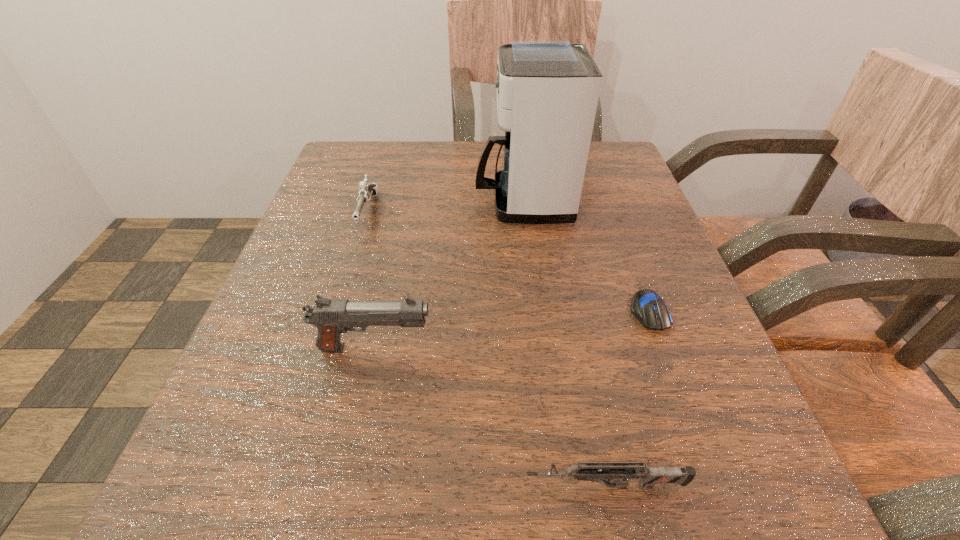
The image size is (960, 540). I want to click on object that is at the near edge, so click(590, 471).

This screenshot has width=960, height=540. I want to click on coffee maker situated at the right edge, so click(547, 90).

You are a GUI agent. You are given a task and a screenshot of the screen. Output one action in this format:
    pyautogui.click(x=<x>, y=<y>)
    Task: Click on the gun that is positioned at the right edge
    
    Given the screenshot: What is the action you would take?
    pyautogui.click(x=590, y=471)

Locate an element on the screen. computer mouse at the right edge is located at coordinates (647, 306).

Image resolution: width=960 pixels, height=540 pixels. In order to click on object at the far left corner in this screenshot , I will do `click(366, 190)`.

Where is `object at the far right corner`? This screenshot has width=960, height=540. object at the far right corner is located at coordinates pyautogui.click(x=547, y=90).

This screenshot has width=960, height=540. Identify the location of object at the near right corner. (590, 471).

The height and width of the screenshot is (540, 960). What are the coordinates of `free region at the far edge of the desktop` in the screenshot? It's located at (440, 176).

Find the location of `free space at the near edge of the desktop`. free space at the near edge of the desktop is located at coordinates (479, 462).

Identify the location of free region at the left edge of the desktop. Image resolution: width=960 pixels, height=540 pixels. (296, 407).